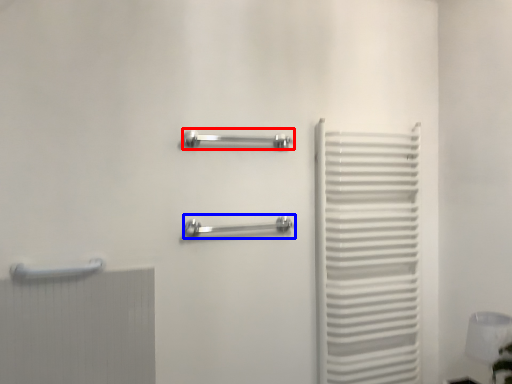
Question: Which object appears closest to the camera in this image, towel rack (highlighted by a red box) or towel rack (highlighted by a blue box)?

Choices:
 (A) towel rack
 (B) towel rack

Answer: (B)